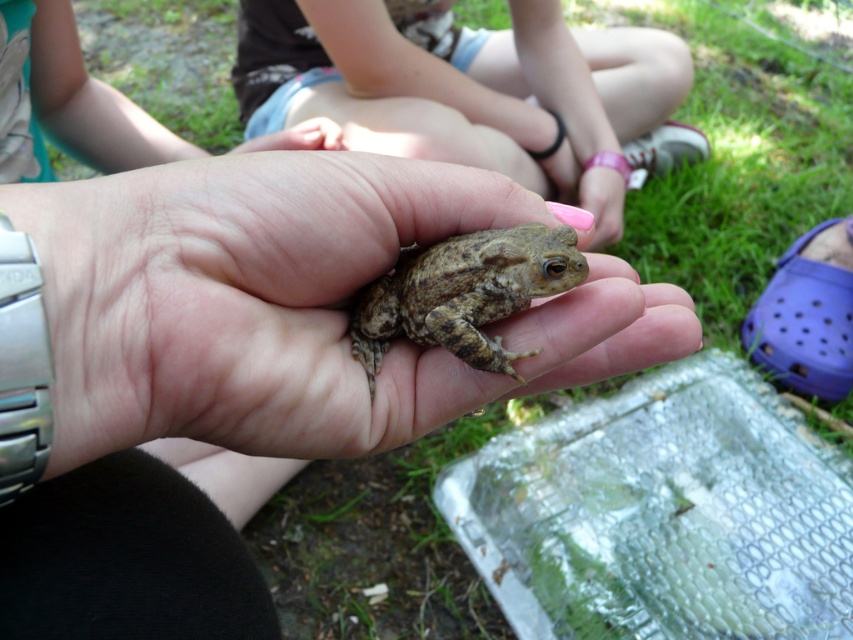
Question: Can you confirm if smooth skin frog at center is positioned to the right of brown textured frog at center?

Choices:
 (A) yes
 (B) no

Answer: (A)

Question: Among these objects, which one is nearest to the camera?

Choices:
 (A) smooth skin frog at center
 (B) brown textured frog at center

Answer: (B)

Question: Does smooth skin frog at center appear on the right side of brown textured frog at center?

Choices:
 (A) yes
 (B) no

Answer: (A)

Question: Which point is farther to the camera?

Choices:
 (A) (573, 38)
 (B) (531, 253)

Answer: (A)

Question: Can you confirm if smooth skin frog at center is positioned to the right of brown textured frog at center?

Choices:
 (A) yes
 (B) no

Answer: (A)